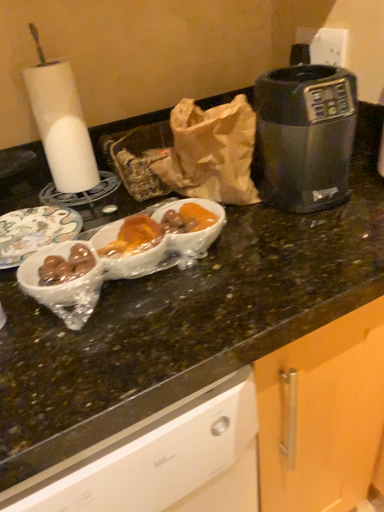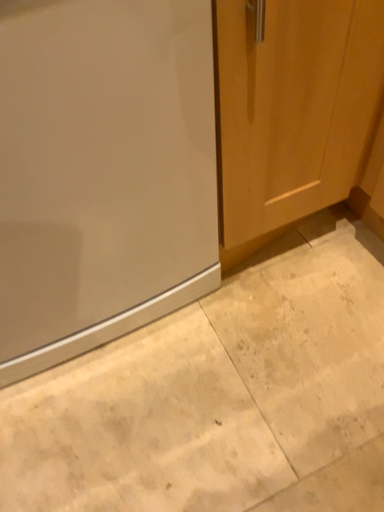
Question: Which way did the camera rotate in the video?

Choices:
 (A) rotated downward
 (B) rotated upward

Answer: (A)